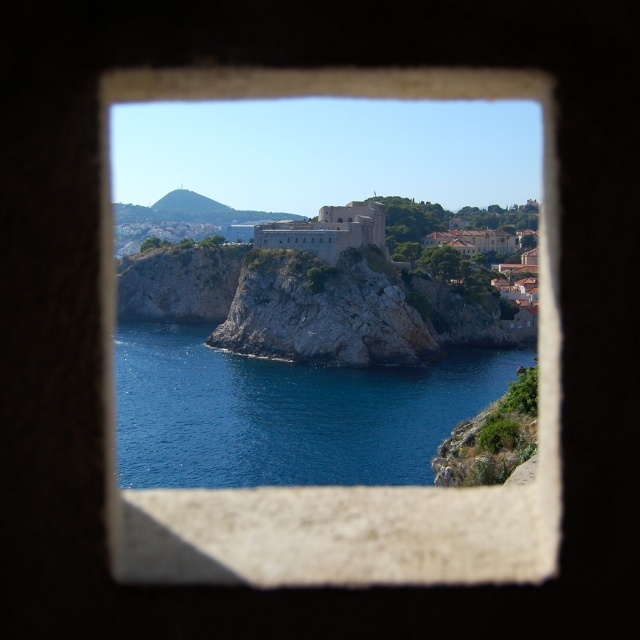
You are standing at the scenic viewpoint looking through the stone frame. You notice the rocky cliff at center and the gray stone fort at center. Which object is positioned closer to your current location?

The rocky cliff at center is closer to the viewer than the gray stone fort at center.

You are a drone operator tasked with capturing aerial footage of the coastal area. Your drone has a maximum flight range of 40 feet. If you are positioned at the blue water at center, can your drone reach the rocky cliff at center without exceeding its range?

The distance between blue water at center and rocky cliff at center is 41.24 feet, which exceeds the drone maximum flight range of 40 feet. Therefore, the drone cannot reach the rocky cliff at center from the blue water at center without exceeding its range.

You are a photographer standing at the edge of the rocky outcrop. You want to capture a photo where the blue water at center and the gray stone fort at center are both visible. Which object will appear larger in the photo?

Result: The blue water at center will appear larger in the photo because it is much taller than the gray stone fort at center according to the description.